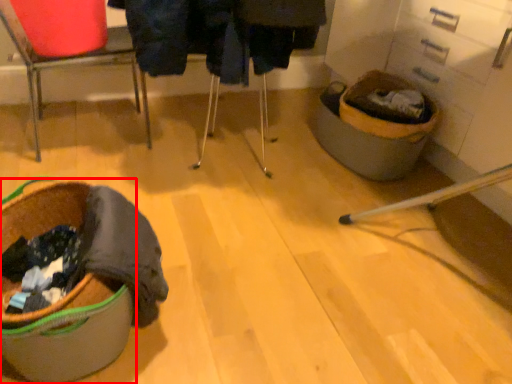
Question: From the image's perspective, where is laundry basket (annotated by the red box) located relative to chair?

Choices:
 (A) below
 (B) above

Answer: (A)